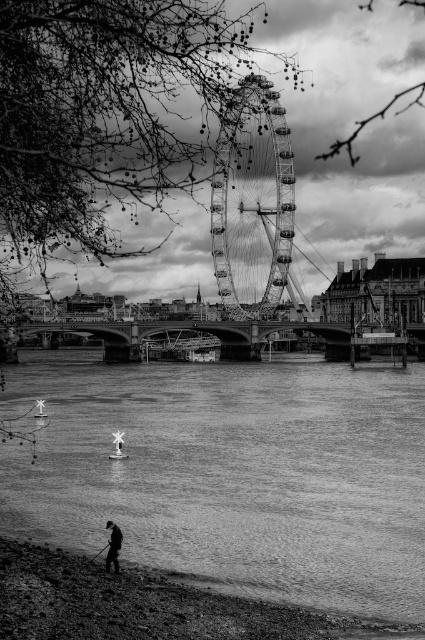
Who is lower down, smooth water at lower center or smooth pebbles at lower left?

Positioned lower is smooth pebbles at lower left.

Which is in front, point (192, 444) or point (51, 627)?

Point (51, 627) is more forward.

This screenshot has height=640, width=425. I want to click on smooth water at lower center, so click(x=232, y=474).

Is metallic ferris wheel at center smaller than dark gray fabric person at lower center?

→ No, metallic ferris wheel at center is not smaller than dark gray fabric person at lower center.

Between metallic ferris wheel at center and dark gray fabric person at lower center, which one appears on the left side from the viewer's perspective?

From the viewer's perspective, dark gray fabric person at lower center appears more on the left side.

At what (x,y) coordinates should I click in order to perform the action: click on metallic ferris wheel at center. Please return your answer as a coordinate pair (x, y). Image resolution: width=425 pixels, height=640 pixels. Looking at the image, I should click on (252, 202).

Between smooth water at lower center and dark gray fabric person at lower center, which one appears on the right side from the viewer's perspective?

smooth water at lower center is more to the right.

Locate an element on the screen. Image resolution: width=425 pixels, height=640 pixels. smooth water at lower center is located at coordinates [232, 474].